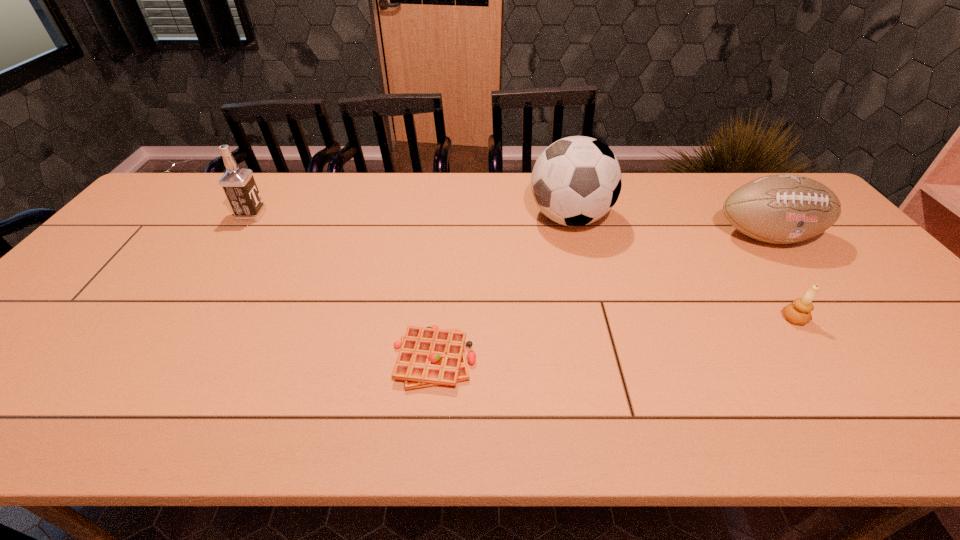
Where is `free space between the vodka and the third shortest object`? This screenshot has width=960, height=540. free space between the vodka and the third shortest object is located at coordinates (509, 226).

Find the location of `unoccupied area between the vodka and the soccer ball`. unoccupied area between the vodka and the soccer ball is located at coordinates (411, 217).

This screenshot has height=540, width=960. I want to click on empty location between the leftmost object and the third object from left to right, so click(411, 217).

Locate an element on the screen. The width and height of the screenshot is (960, 540). vacant space that's between the leftmost object and the football (American) is located at coordinates pos(509,226).

The image size is (960, 540). Identify the location of free space between the soccer ball and the second shortest object. (682, 268).

Identify the location of vacant area that lies between the waffle and the vodka. Image resolution: width=960 pixels, height=540 pixels. (343, 287).

What are the coordinates of `blank region between the fourth farthest object and the third tallest object` in the screenshot? It's located at (780, 278).

Find the location of a particular element. free space between the third shortest object and the soccer ball is located at coordinates (668, 227).

In order to click on vacant region between the third tallest object and the candle_holder in this screenshot , I will do `click(780, 278)`.

Locate which object ranks in proximity to the third shortest object. Please provide its 2D coordinates. Your answer should be formatted as a tuple, i.e. [(x, y)], where the tuple contains the x and y coordinates of a point satisfying the conditions above.

[(799, 312)]